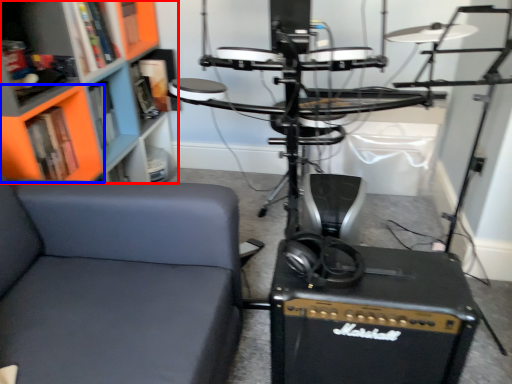
Question: Which object is further to the camera taking this photo, bookcase (highlighted by a red box) or shelf (highlighted by a blue box)?

Choices:
 (A) bookcase
 (B) shelf

Answer: (B)